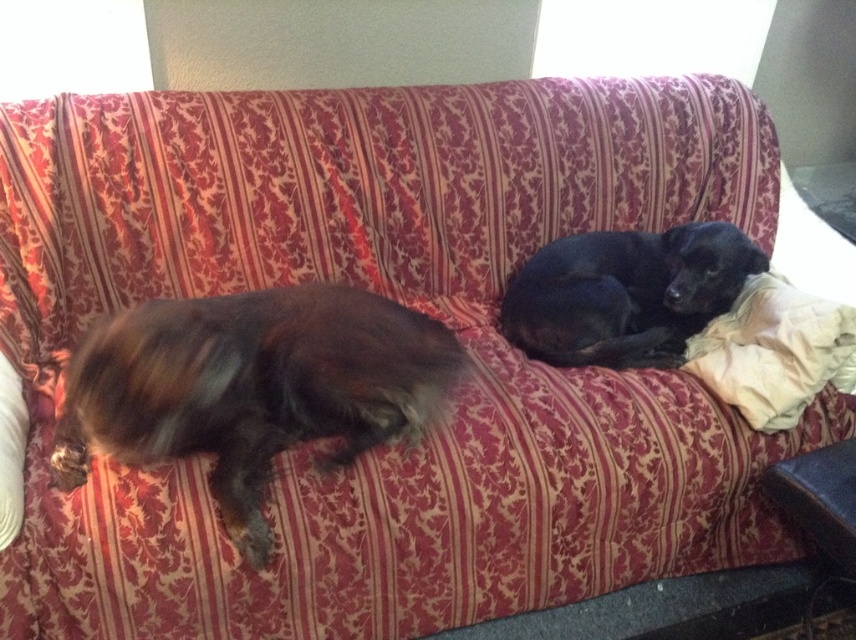
You are a dog owner who wants to place a new dog bed for the brown fuzzy dog at left. The bed must be larger than the white cotton pillow at right. Based on the scene, will the bed fit comfortably on the couch?

The brown fuzzy dog at left is larger in size than the white cotton pillow at right, so a dog bed larger than the pillow should fit comfortably on the couch as the dog itself is bigger than the pillow.

You are a photographer setting up a shot of the black smooth dog at right and the white cotton pillow at right. Which object is closer to the camera?

The black smooth dog at right is closer to the camera than the white cotton pillow at right because it is further to the viewer.

You are taking a photo of the two dogs on the couch. You want to focus on the closer point between point (132, 449) and point (752, 403). Which point should you focus on?

Point (132, 449) is closer to the camera than point (752, 403), so you should focus on point (132, 449).